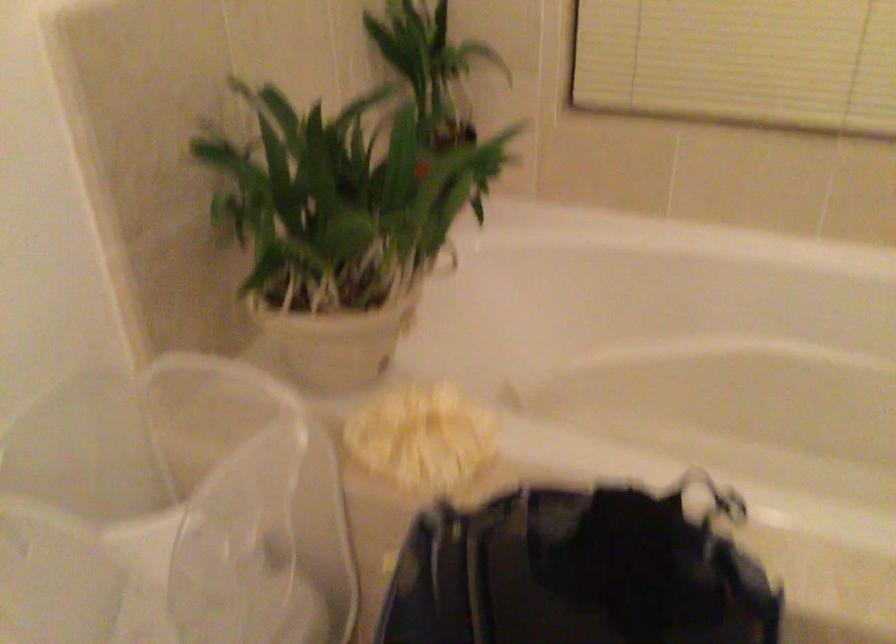
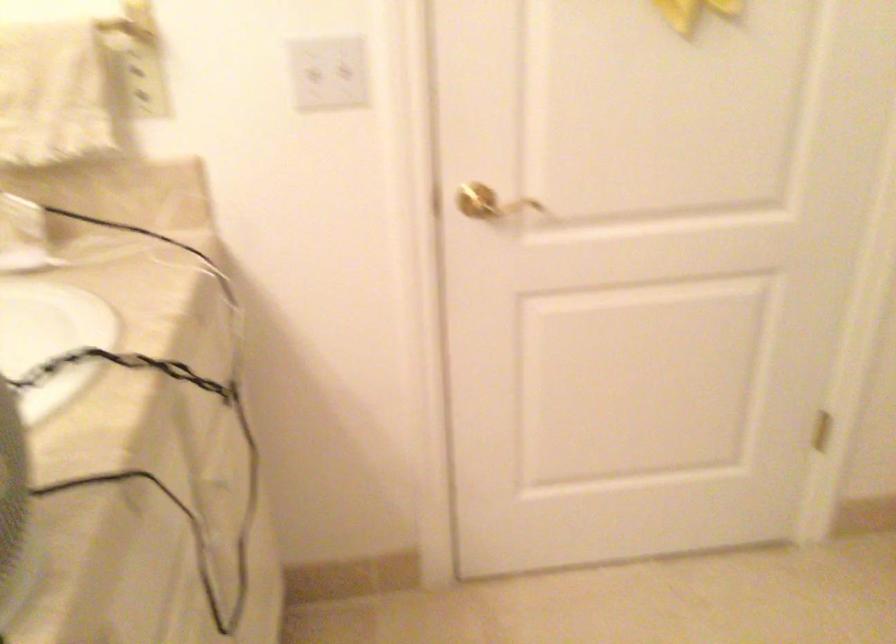
Question: The camera is either moving clockwise (left) or counter-clockwise (right) around the object. The first image is from the beginning of the video and the second image is from the end. Is the camera moving left or right when shooting the video?

Choices:
 (A) Left
 (B) Right

Answer: (B)